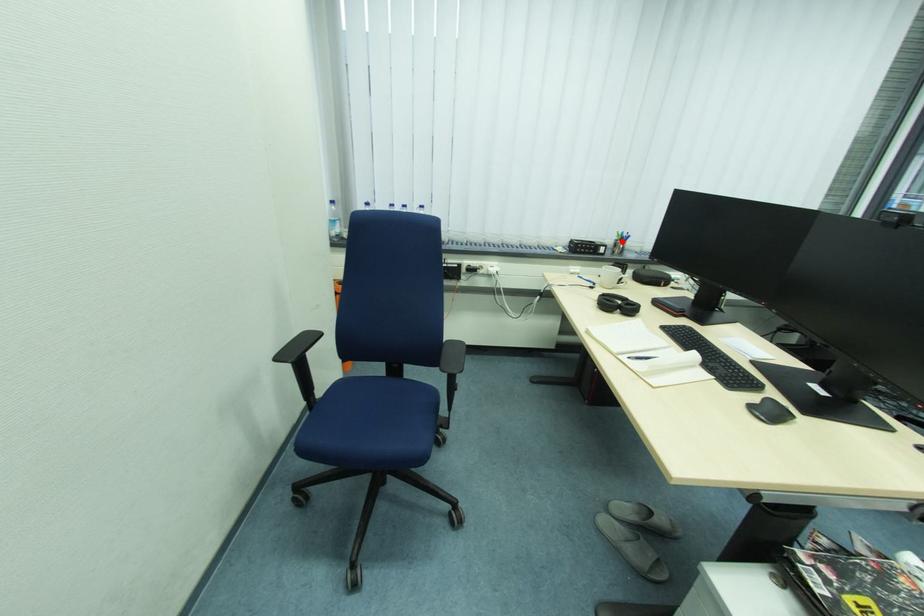
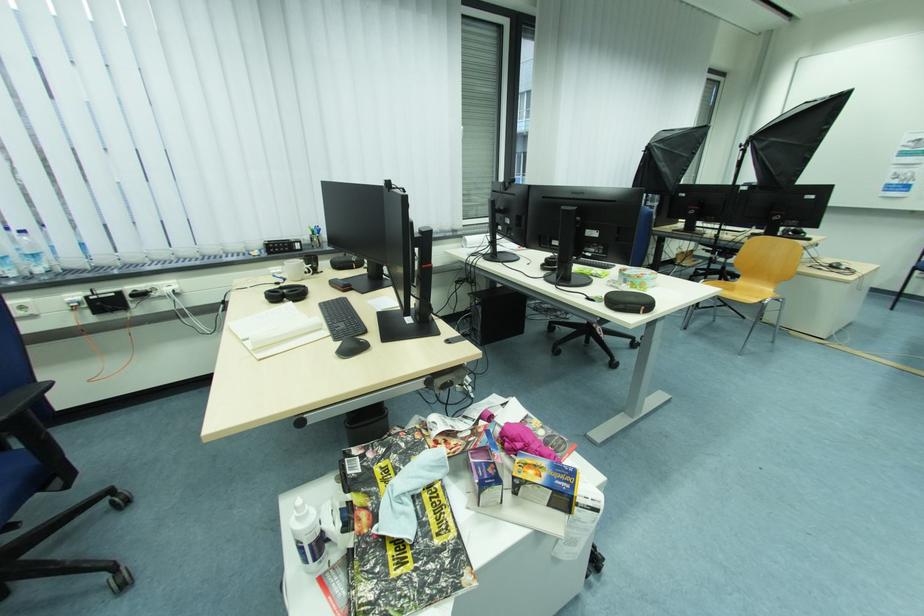
The point at the highlighted location is marked in the first image. Where is the corresponding point in the second image?

(318, 236)